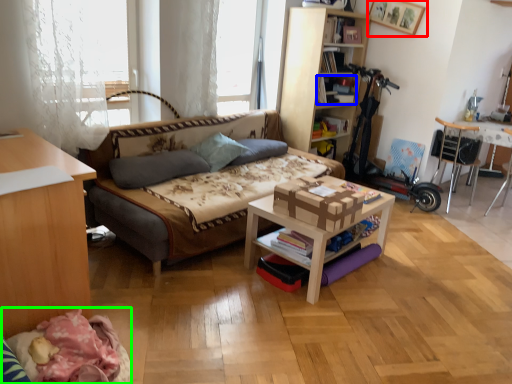
Question: Estimate the real-world distances between objects in this image. Which object is farther from picture frame (highlighted by a red box), book (highlighted by a blue box) or day bed (highlighted by a green box)?

Choices:
 (A) book
 (B) day bed

Answer: (B)